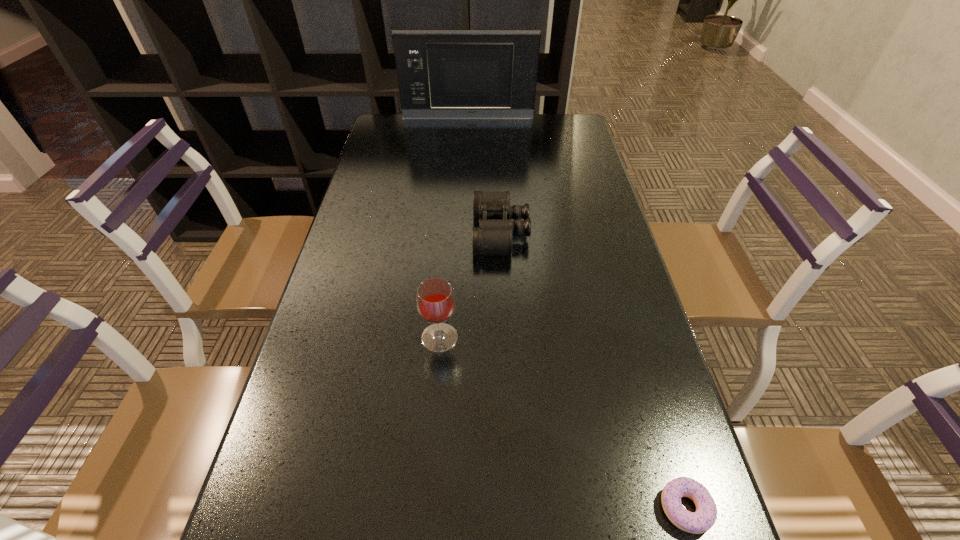
This screenshot has height=540, width=960. I want to click on the tallest object, so click(442, 74).

At what (x,y) coordinates should I click in order to perform the action: click on the farthest object. Please return your answer as a coordinate pair (x, y). Looking at the image, I should click on (442, 74).

Identify the location of the second nearest object. (435, 299).

Where is `the second tallest object`? The width and height of the screenshot is (960, 540). the second tallest object is located at coordinates (435, 299).

This screenshot has height=540, width=960. Find the location of `the third nearest object`. the third nearest object is located at coordinates (494, 236).

Image resolution: width=960 pixels, height=540 pixels. I want to click on the second shortest object, so click(494, 236).

The image size is (960, 540). What are the coordinates of `the shortest object` in the screenshot? It's located at (698, 522).

Locate an element on the screen. Image resolution: width=960 pixels, height=540 pixels. the nearest object is located at coordinates pyautogui.click(x=698, y=522).

Where is `free space located on the front panel of the tallest object`? free space located on the front panel of the tallest object is located at coordinates (466, 180).

This screenshot has height=540, width=960. Identify the location of vacant point located 0.380m on the back of the wineglass. (449, 217).